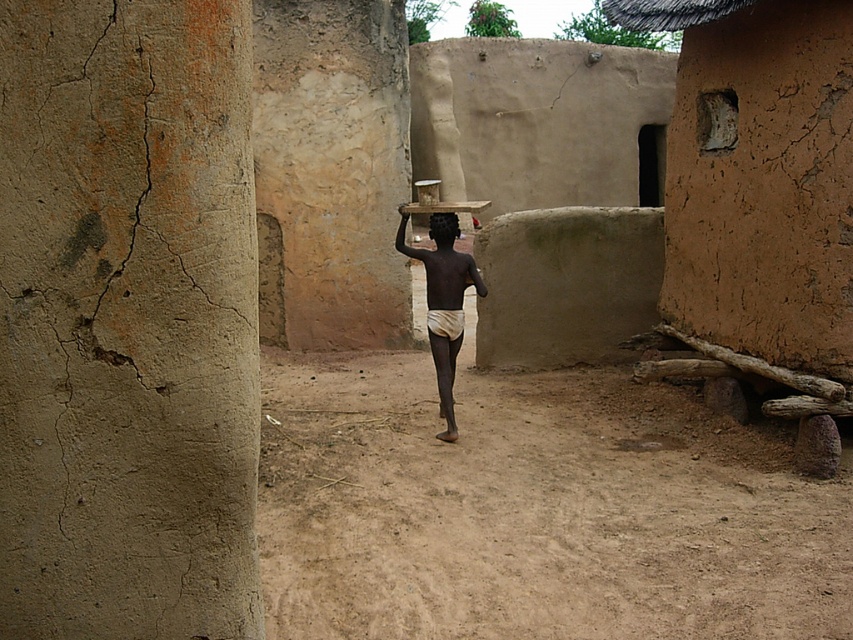
Which is more to the right, light beige cloth at center or black matte head at center?

From the viewer's perspective, light beige cloth at center appears more on the right side.

From the picture: Between light beige cloth at center and black matte head at center, which one is positioned lower?

light beige cloth at center is lower down.

Find the location of `light beige cloth at center`. light beige cloth at center is located at coordinates (444, 301).

I want to click on light beige cloth at center, so click(444, 301).